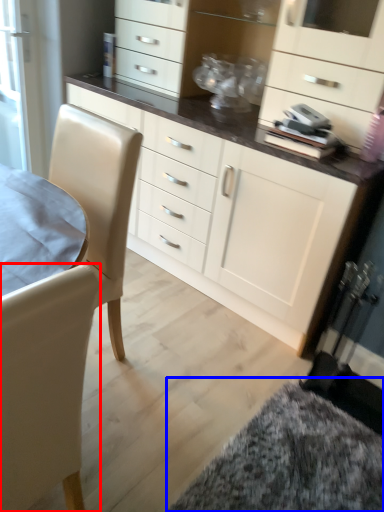
Question: Which object is closer to the camera taking this photo, chair (highlighted by a red box) or wide (highlighted by a blue box)?

Choices:
 (A) chair
 (B) wide

Answer: (A)